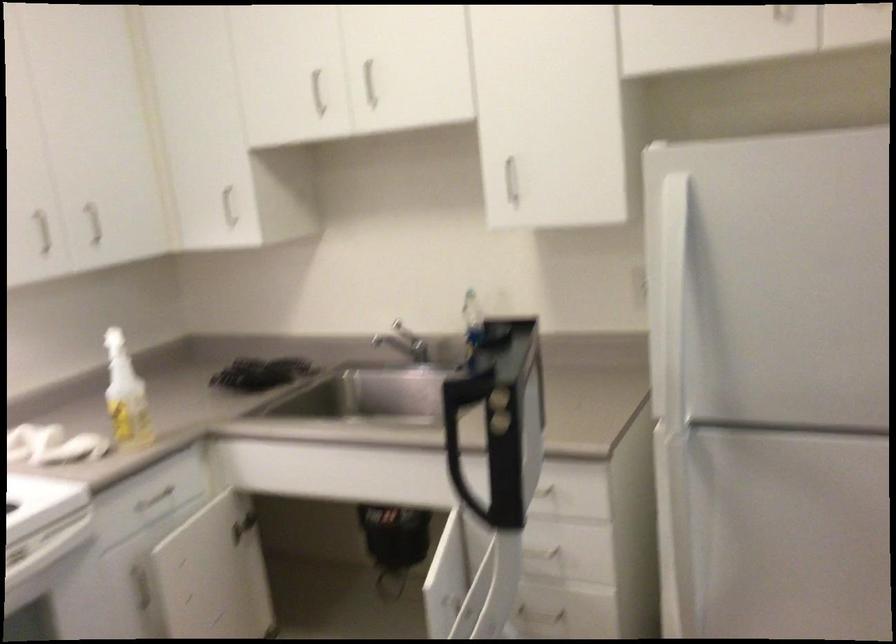
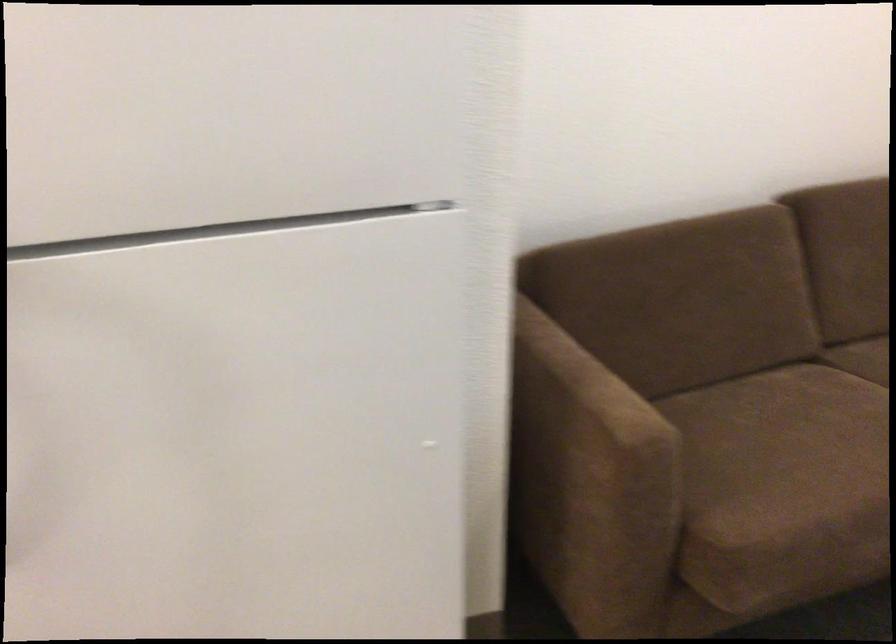
Question: How did the camera likely rotate?

Choices:
 (A) Left
 (B) Right
 (C) Up
 (D) Down

Answer: (B)